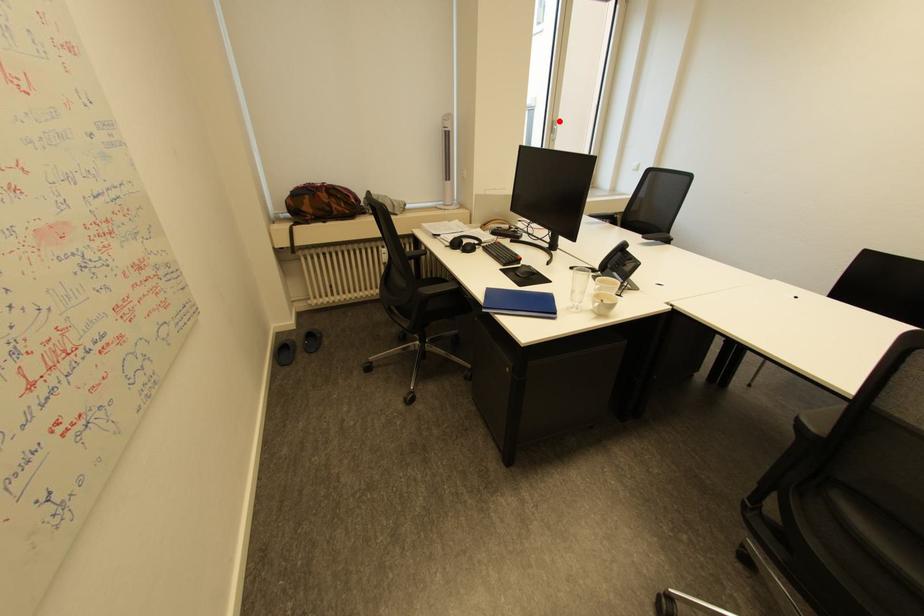
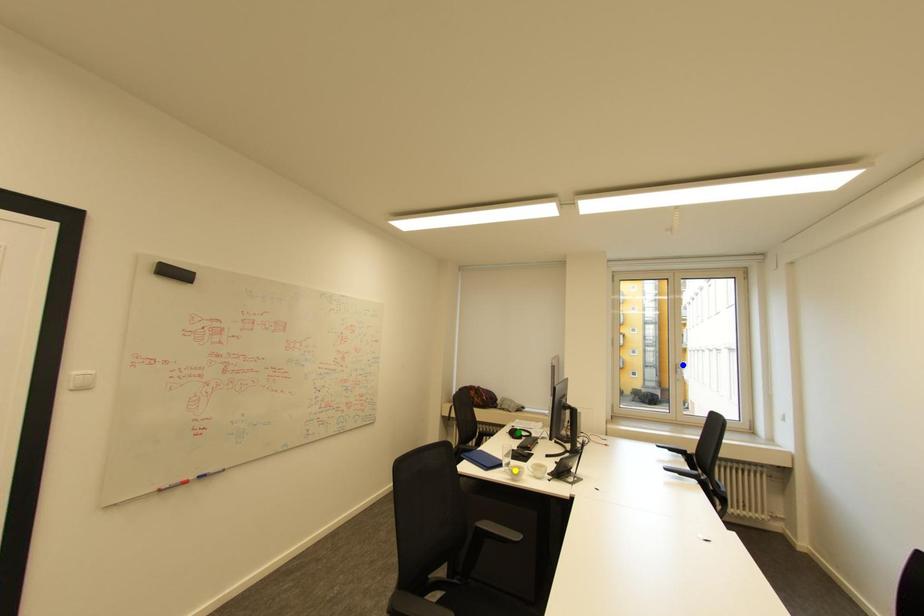
Question: I am providing you with two images of the same scene from different viewpoints. A red point is marked on the first image. You are given multiple points on the second image. In image 2, which mark is for the same physical point as the one in image 1?

Choices:
 (A) blue point
 (B) green point
 (C) yellow point

Answer: (A)